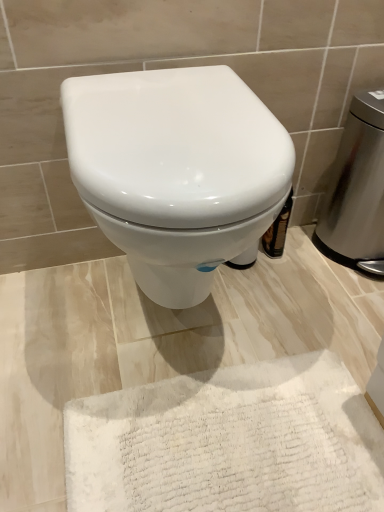
Find the location of `white glossy toilet at center`. white glossy toilet at center is located at coordinates (176, 170).

From a real-world perspective, is white glossy toilet at center beneath white fluffy bath mat at lower center?

No, from a real-world perspective, white glossy toilet at center is not under white fluffy bath mat at lower center.

Are white glossy toilet at center and white fluffy bath mat at lower center located far from each other?

No, white glossy toilet at center is not far from white fluffy bath mat at lower center.

Considering the sizes of objects white glossy toilet at center and white fluffy bath mat at lower center in the image provided, who is thinner, white glossy toilet at center or white fluffy bath mat at lower center?

white glossy toilet at center is thinner.

The image size is (384, 512). I want to click on toilet in front of the white fluffy bath mat at lower center, so (176, 170).

Are white fluffy bath mat at lower center and stainless steel trash can at right far apart?

They are positioned close to each other.

Is stainless steel trash can at right inside white fluffy bath mat at lower center?

No, stainless steel trash can at right is located outside of white fluffy bath mat at lower center.

Is white fluffy bath mat at lower center turned away from stainless steel trash can at right?

No, stainless steel trash can at right is not at the back of white fluffy bath mat at lower center.

Between white glossy toilet at center and stainless steel trash can at right, which one appears on the right side from the viewer's perspective?

stainless steel trash can at right is more to the right.

Measure the distance between white glossy toilet at center and stainless steel trash can at right.

white glossy toilet at center is 19.78 inches away from stainless steel trash can at right.

How many degrees apart are the facing directions of white glossy toilet at center and stainless steel trash can at right?

There is a 0.77-degree angle between the facing directions of white glossy toilet at center and stainless steel trash can at right.

Looking at this image, does white glossy toilet at center have a lesser height compared to stainless steel trash can at right?

Yes.

Does white fluffy bath mat at lower center have a lesser width compared to white glossy toilet at center?

In fact, white fluffy bath mat at lower center might be wider than white glossy toilet at center.

From their relative heights in the image, would you say white fluffy bath mat at lower center is taller or shorter than white glossy toilet at center?

Considering their sizes, white fluffy bath mat at lower center has less height than white glossy toilet at center.

Can white glossy toilet at center be found inside white fluffy bath mat at lower center?

That's incorrect, white glossy toilet at center is not inside white fluffy bath mat at lower center.

Measure the distance between stainless steel trash can at right and white fluffy bath mat at lower center.

stainless steel trash can at right and white fluffy bath mat at lower center are 22.49 inches apart.

Between point (374, 262) and point (381, 454), which one is positioned behind?

The point (374, 262) is farther from the camera.

Which is correct: stainless steel trash can at right is inside white fluffy bath mat at lower center, or outside of it?

stainless steel trash can at right is not inside white fluffy bath mat at lower center, it's outside.

What's the angular difference between stainless steel trash can at right and white fluffy bath mat at lower center's facing directions?

stainless steel trash can at right and white fluffy bath mat at lower center are facing 90.2 degrees away from each other.

Is stainless steel trash can at right taller than white glossy toilet at center?

Indeed, stainless steel trash can at right has a greater height compared to white glossy toilet at center.

Based on the photo, from the image's perspective, is stainless steel trash can at right below white glossy toilet at center?

No, from the image's perspective, stainless steel trash can at right is not beneath white glossy toilet at center.

Is stainless steel trash can at right facing towards white glossy toilet at center?

No, stainless steel trash can at right is not aimed at white glossy toilet at center.

This screenshot has height=512, width=384. Find the location of `bath mat below the white glossy toilet at center (from the image's perspective)`. bath mat below the white glossy toilet at center (from the image's perspective) is located at coordinates (229, 442).

I want to click on appliance behind the white fluffy bath mat at lower center, so click(x=358, y=187).

Looking at the image, which one is located closer to white fluffy bath mat at lower center, white glossy toilet at center or stainless steel trash can at right?

white glossy toilet at center lies closer to white fluffy bath mat at lower center than the other object.

Estimate the real-world distances between objects in this image. Which object is closer to white glossy toilet at center, white fluffy bath mat at lower center or stainless steel trash can at right?

Based on the image, white fluffy bath mat at lower center appears to be nearer to white glossy toilet at center.

Considering their positions, is white fluffy bath mat at lower center positioned closer to stainless steel trash can at right than white glossy toilet at center?

white glossy toilet at center is positioned closer to the anchor stainless steel trash can at right.

Which object lies nearer to the anchor point white glossy toilet at center, stainless steel trash can at right or white fluffy bath mat at lower center?

Among the two, white fluffy bath mat at lower center is located nearer to white glossy toilet at center.

In the scene shown: Which object lies further to the anchor point stainless steel trash can at right, white glossy toilet at center or white fluffy bath mat at lower center?

The object further to stainless steel trash can at right is white fluffy bath mat at lower center.

Estimate the real-world distances between objects in this image. Which object is further from white fluffy bath mat at lower center, stainless steel trash can at right or white glossy toilet at center?

Among the two, stainless steel trash can at right is located further to white fluffy bath mat at lower center.

Where is `bath mat located between white glossy toilet at center and stainless steel trash can at right in the left-right direction`? This screenshot has width=384, height=512. bath mat located between white glossy toilet at center and stainless steel trash can at right in the left-right direction is located at coordinates (229, 442).